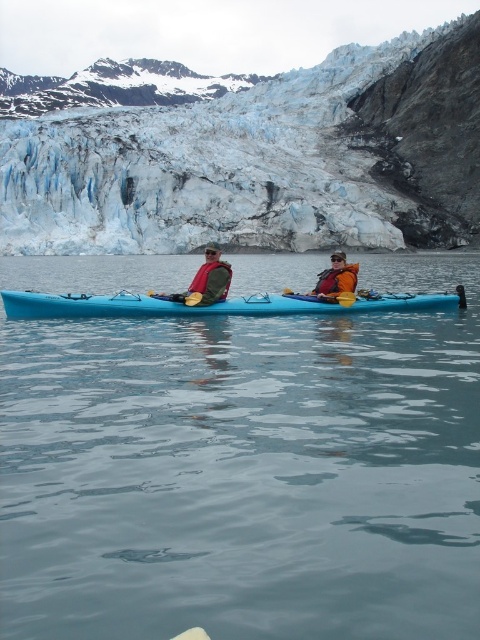
Can you confirm if clear water at center is thinner than yellow plastic paddle at center?

Incorrect, clear water at center's width is not less than yellow plastic paddle at center's.

Can you confirm if clear water at center is bigger than yellow plastic paddle at center?

Indeed, clear water at center has a larger size compared to yellow plastic paddle at center.

Is point (213, 442) farther from viewer compared to point (284, 294)?

No, it is in front of (284, 294).

At what (x,y) coordinates should I click in order to perform the action: click on clear water at center. Please return your answer as a coordinate pair (x, y). Image resolution: width=480 pixels, height=640 pixels. Looking at the image, I should click on (245, 472).

Based on the photo, which is more to the right, blue plastic canoe at center or matte green life jacket at center?

From the viewer's perspective, blue plastic canoe at center appears more on the right side.

Can you confirm if blue plastic canoe at center is positioned to the left of matte green life jacket at center?

Incorrect, blue plastic canoe at center is not on the left side of matte green life jacket at center.

This screenshot has height=640, width=480. Identify the location of blue plastic canoe at center. (217, 305).

Does point (324, 557) come farther from viewer compared to point (316, 292)?

No.

Where is `clear water at center`? clear water at center is located at coordinates (245, 472).